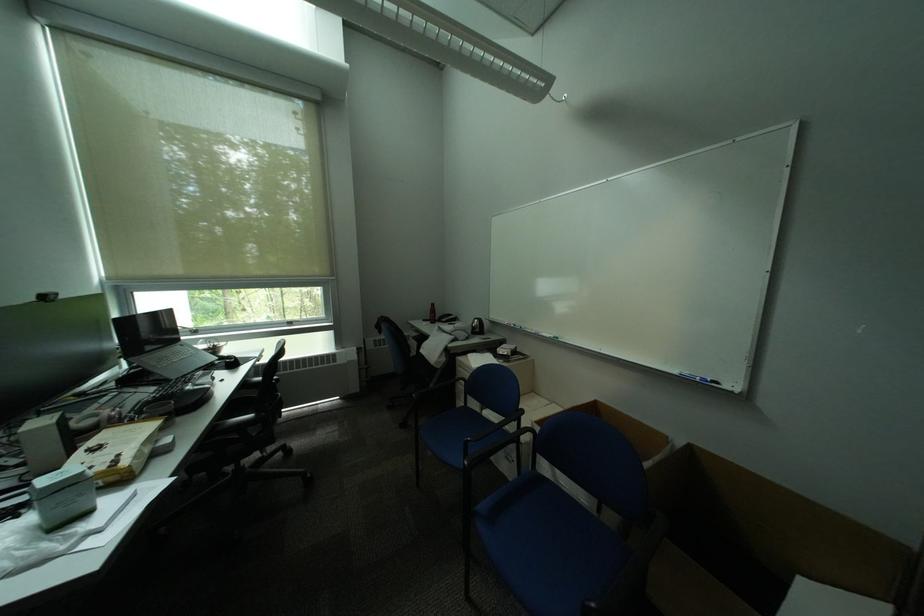
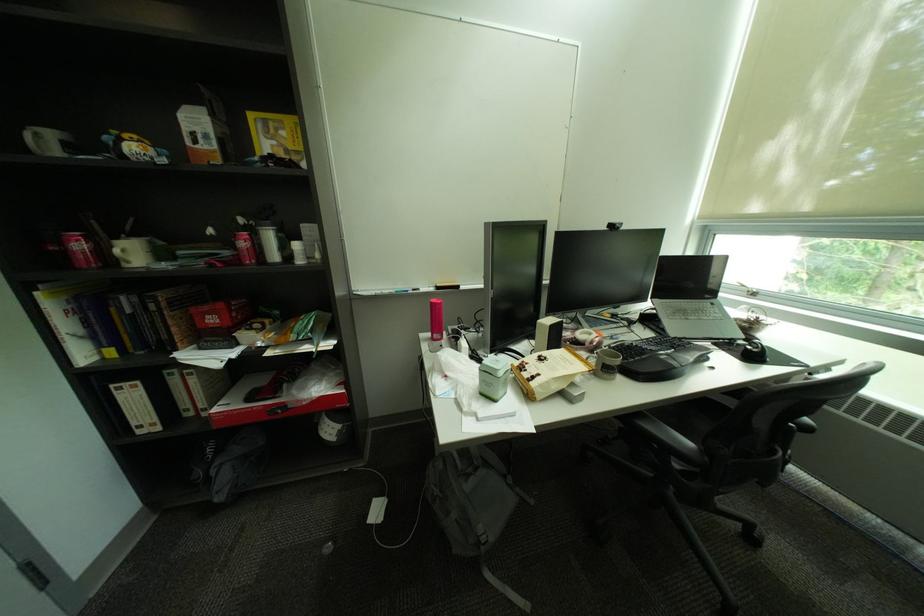
In the second image, find the point that corresponds to pixel 54 297 in the first image.

(621, 227)